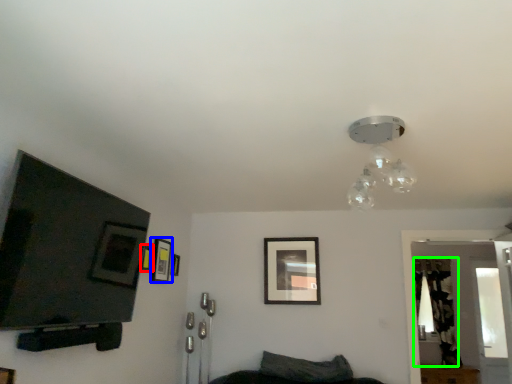
Question: Which object is positioned farthest from picture frame (highlighted by a red box)? Select from picture frame (highlighted by a blue box) and curtain (highlighted by a green box).

Choices:
 (A) picture frame
 (B) curtain

Answer: (B)